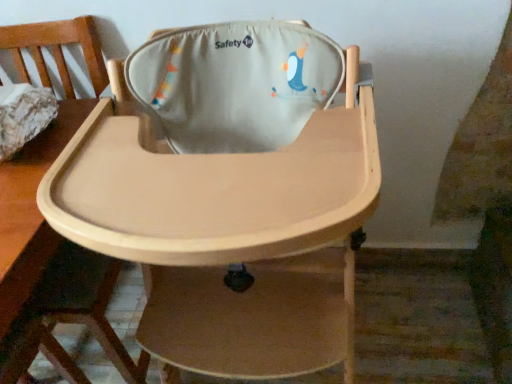
Question: Is matte beige highchair at center, the second chair when ordered from right to left, far from natural wood highchair at center, which is the 2th chair from left to right?

Choices:
 (A) no
 (B) yes

Answer: (A)

Question: Could natural wood highchair at center, which is counted as the first chair, starting from the right, be considered to be inside matte beige highchair at center, the second chair when ordered from right to left?

Choices:
 (A) no
 (B) yes

Answer: (A)

Question: Is the depth of matte beige highchair at center, the second chair when ordered from right to left, less than that of natural wood highchair at center, which is counted as the first chair, starting from the right?

Choices:
 (A) no
 (B) yes

Answer: (A)

Question: Is matte beige highchair at center, acting as the first chair starting from the left, shorter than natural wood highchair at center, which is counted as the first chair, starting from the right?

Choices:
 (A) yes
 (B) no

Answer: (A)

Question: From the image's perspective, does matte beige highchair at center, the second chair when ordered from right to left, appear higher than natural wood highchair at center, which is the 2th chair from left to right?

Choices:
 (A) yes
 (B) no

Answer: (A)

Question: From a real-world perspective, is matte beige highchair at center, the second chair when ordered from right to left, below natural wood highchair at center, which is counted as the first chair, starting from the right?

Choices:
 (A) no
 (B) yes

Answer: (B)

Question: Does natural wood highchair at center, which is counted as the first chair, starting from the right, have a greater width compared to matte beige highchair at center, acting as the first chair starting from the left?

Choices:
 (A) no
 (B) yes

Answer: (A)

Question: Is natural wood highchair at center, which is the 2th chair from left to right, to the left of matte beige highchair at center, acting as the first chair starting from the left, from the viewer's perspective?

Choices:
 (A) no
 (B) yes

Answer: (A)

Question: Considering the relative sizes of natural wood highchair at center, which is the 2th chair from left to right, and matte beige highchair at center, acting as the first chair starting from the left, in the image provided, is natural wood highchair at center, which is the 2th chair from left to right, thinner than matte beige highchair at center, acting as the first chair starting from the left,?

Choices:
 (A) yes
 (B) no

Answer: (A)

Question: Is natural wood highchair at center, which is counted as the first chair, starting from the right, facing towards matte beige highchair at center, the second chair when ordered from right to left?

Choices:
 (A) yes
 (B) no

Answer: (B)

Question: Does natural wood highchair at center, which is the 2th chair from left to right, lie behind matte beige highchair at center, acting as the first chair starting from the left?

Choices:
 (A) yes
 (B) no

Answer: (B)

Question: Can you confirm if natural wood highchair at center, which is counted as the first chair, starting from the right, is shorter than matte beige highchair at center, acting as the first chair starting from the left?

Choices:
 (A) no
 (B) yes

Answer: (A)

Question: From a real-world perspective, is matte beige highchair at center, the second chair when ordered from right to left, positioned above or below natural wood highchair at center, which is the 2th chair from left to right?

Choices:
 (A) above
 (B) below

Answer: (B)